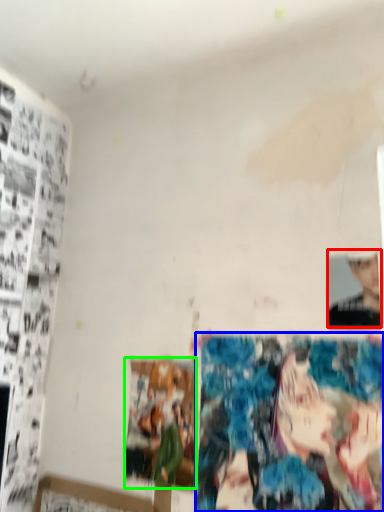
Question: Estimate the real-world distances between objects in this image. Which object is farther from person (highlighted by a red box), reflection (highlighted by a blue box) or print (highlighted by a green box)?

Choices:
 (A) reflection
 (B) print

Answer: (B)